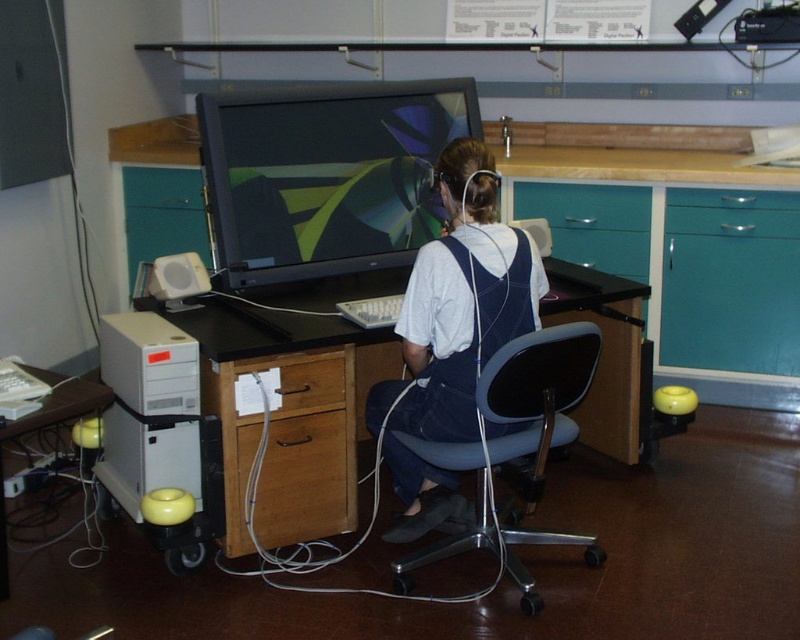
You are standing at the entrance of the laboratory and see the desk with a wooden surface. There is a point marked at coordinates (584, 205) on the desk. What object is located at that point?

The point at coordinates (584, 205) marks the teal wood drawer at center.